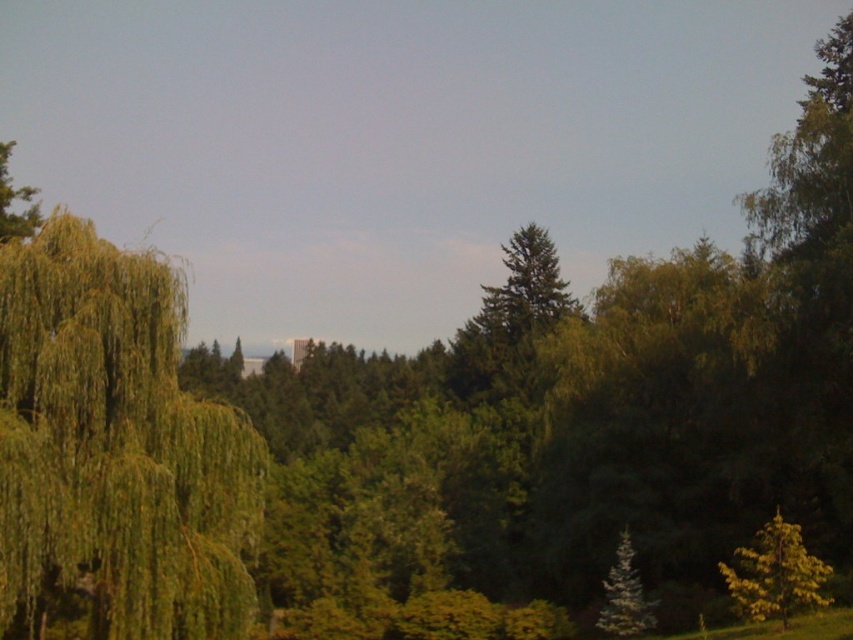
Who is lower down, green leafy willow at left or green matte tree at lower right?

green matte tree at lower right

Can you confirm if green leafy willow at left is thinner than green matte tree at lower right?

Correct, green leafy willow at left's width is less than green matte tree at lower right's.

What are the coordinates of `green leafy willow at left` in the screenshot? It's located at (117, 445).

Which is more to the right, yellow-green leafy tree at lower right or green matte tree at lower right?

From the viewer's perspective, yellow-green leafy tree at lower right appears more on the right side.

Describe the element at coordinates (775, 573) in the screenshot. I see `yellow-green leafy tree at lower right` at that location.

At what (x,y) coordinates should I click in order to perform the action: click on yellow-green leafy tree at lower right. Please return your answer as a coordinate pair (x, y). Image resolution: width=853 pixels, height=640 pixels. Looking at the image, I should click on click(x=775, y=573).

Which is more to the right, green leafy willow at left or yellow-green leafy tree at lower right?

From the viewer's perspective, yellow-green leafy tree at lower right appears more on the right side.

Can you confirm if green leafy willow at left is smaller than yellow-green leafy tree at lower right?

Indeed, green leafy willow at left has a smaller size compared to yellow-green leafy tree at lower right.

Which is in front, point (158, 499) or point (793, 531)?

Point (158, 499)

This screenshot has width=853, height=640. I want to click on green leafy willow at left, so [117, 445].